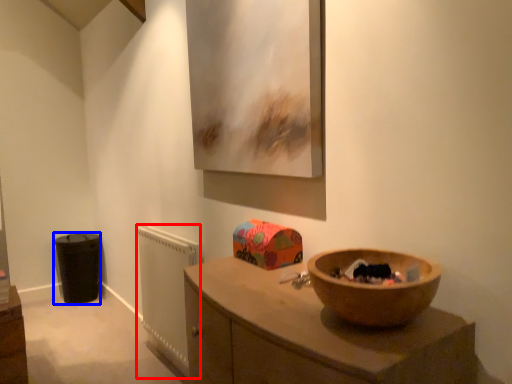
Question: Which object appears closest to the camera in this image, radiator (highlighted by a red box) or cabinetry (highlighted by a blue box)?

Choices:
 (A) radiator
 (B) cabinetry

Answer: (A)